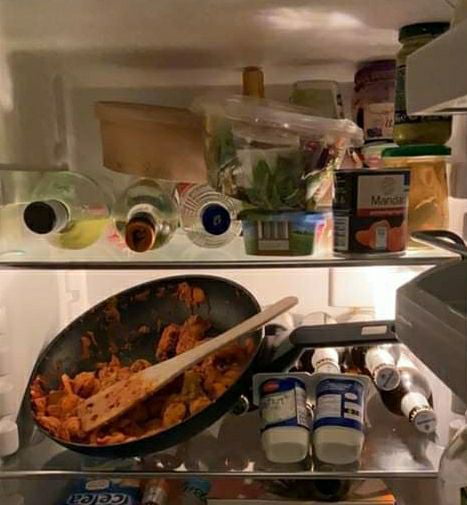
Locate an element on the screen. wooden spoon is located at coordinates (149, 377).